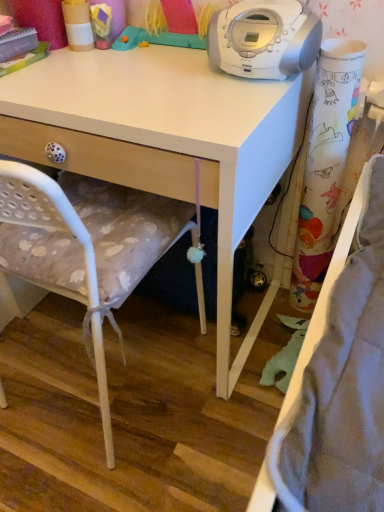
This screenshot has height=512, width=384. What are the coordinates of `free spot above white matte desk at upper center (from a real-world perspective)` in the screenshot? It's located at (113, 70).